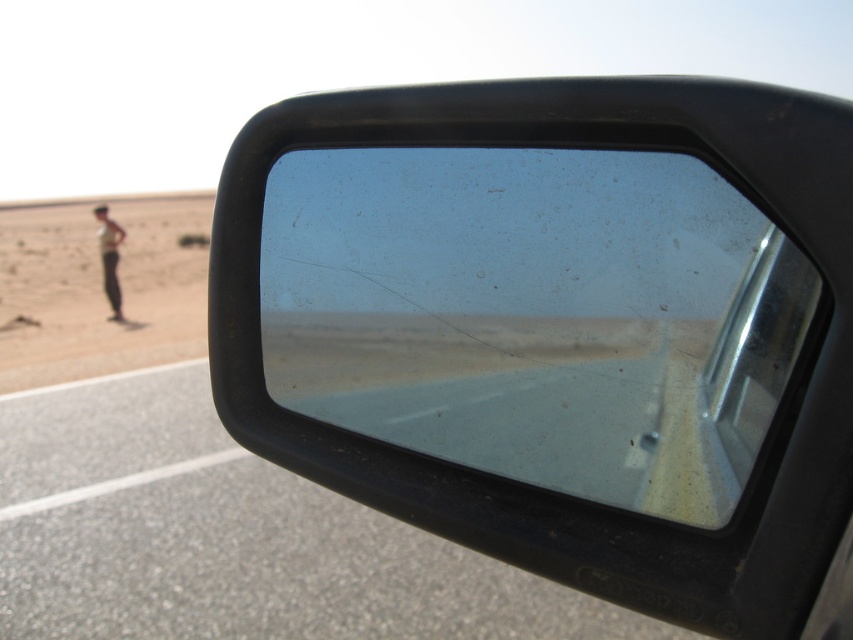
Based on the photo, you are driving a car and looking at the side mirror. You see the desertdry sand at left and the light brown skin at lower left in the reflection. Which object is positioned more to the right in the mirror?

The desertdry sand at left is positioned more to the right in the mirror than the light brown skin at lower left.

You are a driver who just got into a car. You notice the clear plastic mirror at center has a small scratch at its top edge. To check if the scratch affects your view of the road, where exactly is the scratch located relative to the mirror?

The scratch is located at the top edge of the clear plastic mirror at center.

You are a passenger in a car and want to see the road ahead. You notice the clear glass window at center and the light brown skin at lower left. Which object should you look through to get a clearer view of the road ahead?

You should look through the clear glass window at center to get a clearer view of the road ahead since it is in front of the light brown skin at lower left, which is blocking the view.